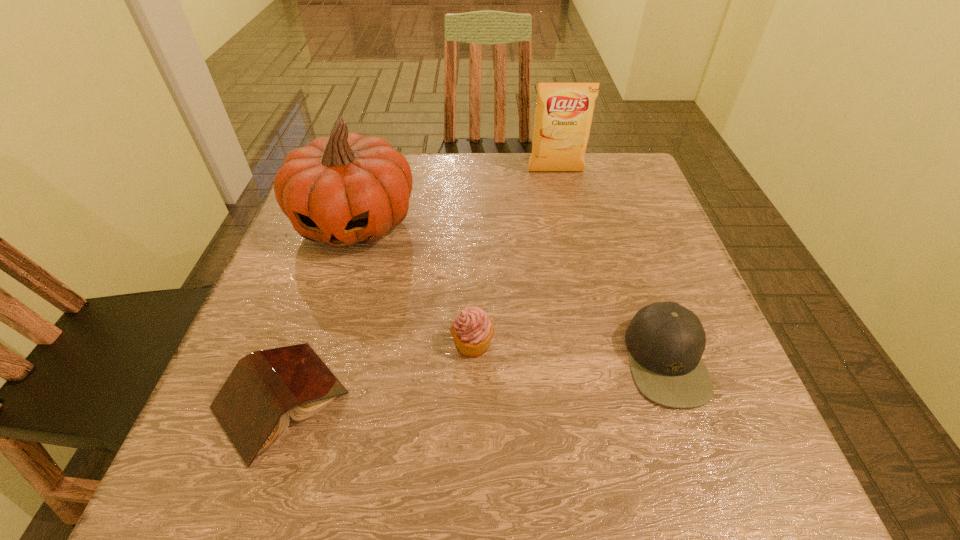
Find the location of a particular element. The height and width of the screenshot is (540, 960). vacant position located 0.080m on the brim of the cap is located at coordinates (581, 360).

The width and height of the screenshot is (960, 540). I want to click on free space located on the back of the book, so click(x=325, y=271).

I want to click on crisp (potato chip) positioned at the far edge, so click(x=563, y=116).

Locate an element on the screen. The width and height of the screenshot is (960, 540). pumpkin that is at the far edge is located at coordinates (346, 189).

Where is `object that is at the near edge`? object that is at the near edge is located at coordinates (253, 406).

This screenshot has height=540, width=960. Identify the location of pumpkin located at the left edge. (346, 189).

The image size is (960, 540). I want to click on book that is at the left edge, so click(253, 406).

At what (x,y) coordinates should I click in order to perform the action: click on crisp (potato chip) that is at the right edge. Please return your answer as a coordinate pair (x, y). Looking at the image, I should click on (563, 116).

Locate an element on the screen. cap located at the right edge is located at coordinates (666, 341).

This screenshot has width=960, height=540. I want to click on object present at the far left corner, so click(346, 189).